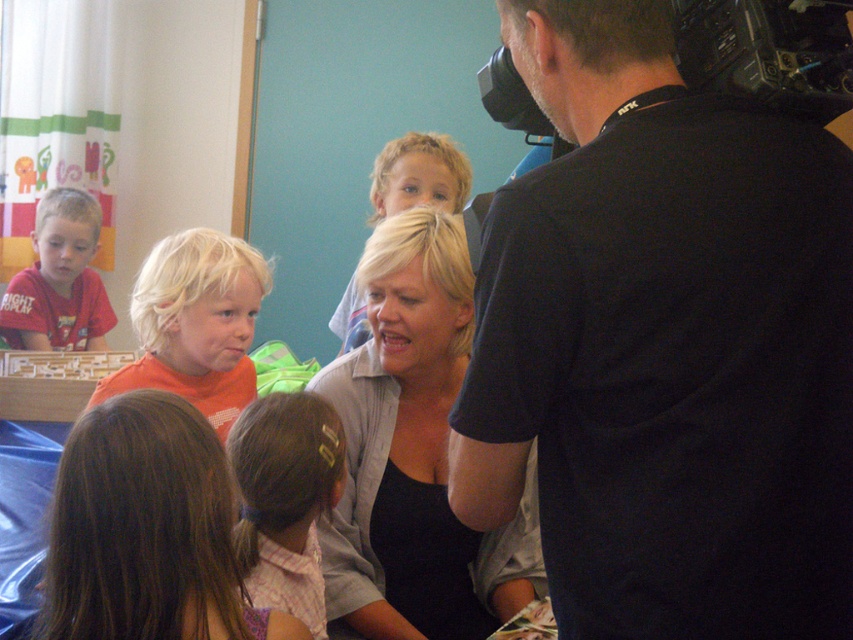
Can you confirm if black matte shirt at center is positioned to the left of pink plaid shirt at center?

Incorrect, black matte shirt at center is not on the left side of pink plaid shirt at center.

Does point (436, 563) come closer to viewer compared to point (276, 433)?

No, it is behind (276, 433).

Is point (404, 636) positioned before point (303, 528)?

No, (404, 636) is further to viewer.

Image resolution: width=853 pixels, height=640 pixels. In order to click on black matte shirt at center in this screenshot , I will do `click(415, 452)`.

Does brown hair at lower left have a lesser height compared to matte red shirt at left?

Yes, brown hair at lower left is shorter than matte red shirt at left.

From the picture: Who is lower down, brown hair at lower left or matte red shirt at left?

Positioned lower is brown hair at lower left.

Which is in front, point (119, 515) or point (0, 316)?

Point (119, 515) is more forward.

You are a GUI agent. You are given a task and a screenshot of the screen. Output one action in this format:
    pyautogui.click(x=<x>, y=<y>)
    Task: Click on the brown hair at lower left
    
    Given the screenshot: What is the action you would take?
    pyautogui.click(x=148, y=531)

Who is more distant from viewer, (45, 310) or (401, 196)?

The point (45, 310) is more distant.

In the scene shown: Is matte red shirt at left positioned behind blonde hair at center?

Yes, it is.

Measure the distance between point (74, 193) and camera.

Point (74, 193) and camera are 9.46 feet apart from each other.

This screenshot has height=640, width=853. I want to click on matte red shirt at left, so click(x=59, y=280).